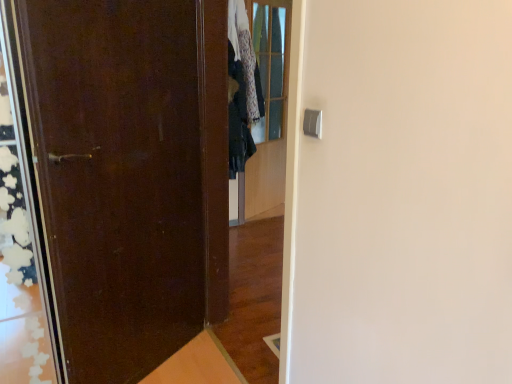
Question: Are matte dark brown door at left and dark green fabric at center making contact?

Choices:
 (A) no
 (B) yes

Answer: (A)

Question: Can you confirm if matte dark brown door at left is smaller than dark green fabric at center?

Choices:
 (A) yes
 (B) no

Answer: (B)

Question: Does matte dark brown door at left appear on the right side of dark green fabric at center?

Choices:
 (A) yes
 (B) no

Answer: (B)

Question: Is matte dark brown door at left not near dark green fabric at center?

Choices:
 (A) yes
 (B) no

Answer: (A)

Question: Can you confirm if matte dark brown door at left is thinner than dark green fabric at center?

Choices:
 (A) yes
 (B) no

Answer: (A)

Question: Is dark green fabric at center bigger or smaller than clear glass door at upper center?

Choices:
 (A) big
 (B) small

Answer: (B)

Question: In the image, is dark green fabric at center on the left side or the right side of clear glass door at upper center?

Choices:
 (A) left
 (B) right

Answer: (A)

Question: From the image's perspective, relative to clear glass door at upper center, is dark green fabric at center above or below?

Choices:
 (A) below
 (B) above

Answer: (B)

Question: Relative to clear glass door at upper center, is dark green fabric at center in front or behind?

Choices:
 (A) behind
 (B) front

Answer: (B)

Question: From the image's perspective, is matte dark brown door at left above or below clear glass door at upper center?

Choices:
 (A) above
 (B) below

Answer: (B)

Question: Is matte dark brown door at left wider or thinner than clear glass door at upper center?

Choices:
 (A) wide
 (B) thin

Answer: (A)

Question: Considering the positions of point (138, 170) and point (262, 56), is point (138, 170) closer or farther from the camera than point (262, 56)?

Choices:
 (A) closer
 (B) farther

Answer: (A)

Question: Is matte dark brown door at left spatially inside clear glass door at upper center, or outside of it?

Choices:
 (A) inside
 (B) outside

Answer: (B)

Question: Is clear glass door at upper center bigger or smaller than matte dark brown door at left?

Choices:
 (A) small
 (B) big

Answer: (A)

Question: Looking at their shapes, would you say clear glass door at upper center is wider or thinner than matte dark brown door at left?

Choices:
 (A) thin
 (B) wide

Answer: (A)